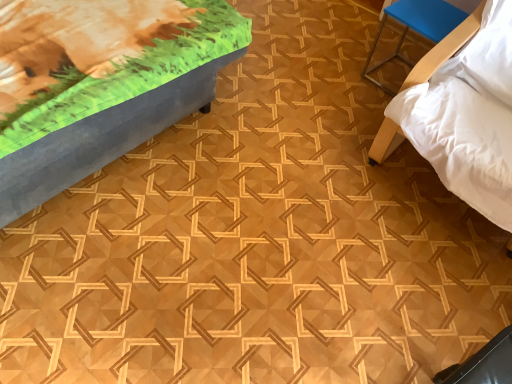
Question: Is white soft bed at right, the first furniture from the right, positioned with its back to matte gray bench at upper left, acting as the 1th furniture starting from the left?

Choices:
 (A) yes
 (B) no

Answer: (B)

Question: From a real-world perspective, is white soft bed at right, the first furniture from the right, located higher than matte gray bench at upper left, acting as the 1th furniture starting from the left?

Choices:
 (A) no
 (B) yes

Answer: (B)

Question: From the image's perspective, is white soft bed at right, the 3th furniture from the left, on matte gray bench at upper left, marked as the 3th furniture in a right-to-left arrangement?

Choices:
 (A) no
 (B) yes

Answer: (A)

Question: Can you confirm if white soft bed at right, the first furniture from the right, is bigger than matte gray bench at upper left, acting as the 1th furniture starting from the left?

Choices:
 (A) yes
 (B) no

Answer: (B)

Question: From the image's perspective, is white soft bed at right, the first furniture from the right, below matte gray bench at upper left, marked as the 3th furniture in a right-to-left arrangement?

Choices:
 (A) yes
 (B) no

Answer: (A)

Question: Considering the positions of matte gray bench at upper left, marked as the 3th furniture in a right-to-left arrangement, and white soft bed at right, the first furniture from the right, in the image, is matte gray bench at upper left, marked as the 3th furniture in a right-to-left arrangement, wider or thinner than white soft bed at right, the first furniture from the right,?

Choices:
 (A) thin
 (B) wide

Answer: (A)

Question: Is matte gray bench at upper left, marked as the 3th furniture in a right-to-left arrangement, in front of or behind white soft bed at right, the 3th furniture from the left, in the image?

Choices:
 (A) front
 (B) behind

Answer: (A)

Question: From the image's perspective, is matte gray bench at upper left, acting as the 1th furniture starting from the left, located above or below white soft bed at right, the first furniture from the right?

Choices:
 (A) above
 (B) below

Answer: (A)

Question: Is matte gray bench at upper left, marked as the 3th furniture in a right-to-left arrangement, to the left or to the right of white soft bed at right, the first furniture from the right, in the image?

Choices:
 (A) right
 (B) left

Answer: (B)

Question: Is blue plastic stool at upper right, positioned as the 2th furniture in right-to-left order, inside the boundaries of matte gray bench at upper left, acting as the 1th furniture starting from the left, or outside?

Choices:
 (A) outside
 (B) inside

Answer: (A)

Question: From a real-world perspective, is blue plastic stool at upper right, marked as the second furniture in a left-to-right arrangement, above or below matte gray bench at upper left, acting as the 1th furniture starting from the left?

Choices:
 (A) below
 (B) above

Answer: (A)

Question: Is blue plastic stool at upper right, marked as the second furniture in a left-to-right arrangement, to the left or to the right of matte gray bench at upper left, acting as the 1th furniture starting from the left, in the image?

Choices:
 (A) right
 (B) left

Answer: (A)

Question: Looking at their shapes, would you say blue plastic stool at upper right, marked as the second furniture in a left-to-right arrangement, is wider or thinner than matte gray bench at upper left, marked as the 3th furniture in a right-to-left arrangement?

Choices:
 (A) wide
 (B) thin

Answer: (B)

Question: From the image's perspective, is white soft bed at right, the first furniture from the right, located above or below blue plastic stool at upper right, positioned as the 2th furniture in right-to-left order?

Choices:
 (A) above
 (B) below

Answer: (B)

Question: Looking at their shapes, would you say white soft bed at right, the first furniture from the right, is wider or thinner than blue plastic stool at upper right, positioned as the 2th furniture in right-to-left order?

Choices:
 (A) thin
 (B) wide

Answer: (B)